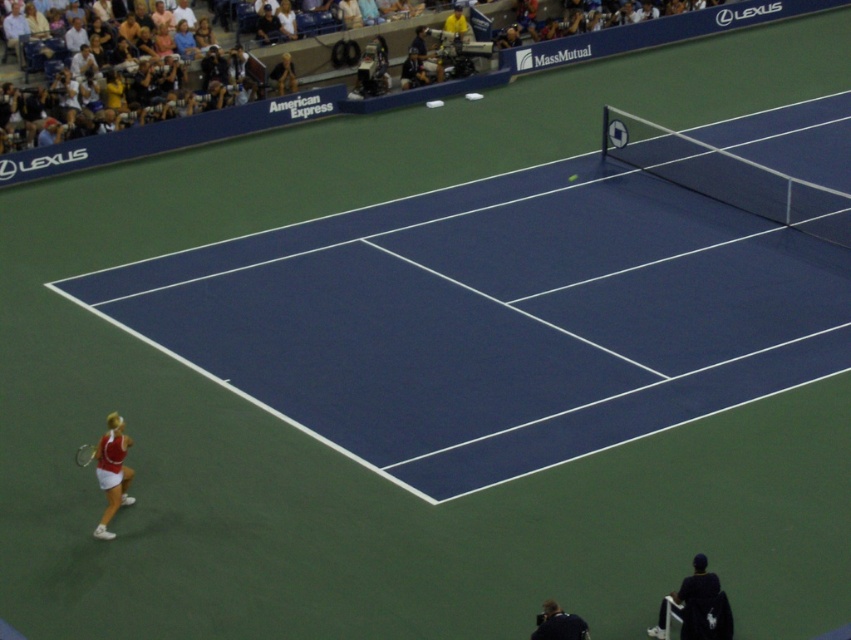
Can you confirm if metallic silver tennis racket at lower left is bigger than green rubber tennis ball at center?

Yes.

Can you confirm if metallic silver tennis racket at lower left is thinner than green rubber tennis ball at center?

No, metallic silver tennis racket at lower left is not thinner than green rubber tennis ball at center.

Find the location of a particular element. This screenshot has height=640, width=851. metallic silver tennis racket at lower left is located at coordinates (84, 454).

In order to click on metallic silver tennis racket at lower left in this screenshot , I will do `click(84, 454)`.

Between point (107, 538) and point (89, 458), which one is positioned behind?

Point (89, 458)

Does white fabric tennis outfit at lower left appear under metallic silver tennis racket at lower left?

Yes, white fabric tennis outfit at lower left is below metallic silver tennis racket at lower left.

Image resolution: width=851 pixels, height=640 pixels. Describe the element at coordinates (112, 472) in the screenshot. I see `white fabric tennis outfit at lower left` at that location.

The width and height of the screenshot is (851, 640). I want to click on white fabric tennis outfit at lower left, so click(x=112, y=472).

Which of these two, white fabric tennis outfit at lower left or dark blue jacket at lower right, stands taller?

Standing taller between the two is white fabric tennis outfit at lower left.

Which is more to the right, white fabric tennis outfit at lower left or dark blue jacket at lower right?

From the viewer's perspective, dark blue jacket at lower right appears more on the right side.

Between point (98, 532) and point (580, 637), which one is positioned behind?

The point (98, 532) is behind.

Find the location of a particular element. The width and height of the screenshot is (851, 640). white fabric tennis outfit at lower left is located at coordinates (112, 472).